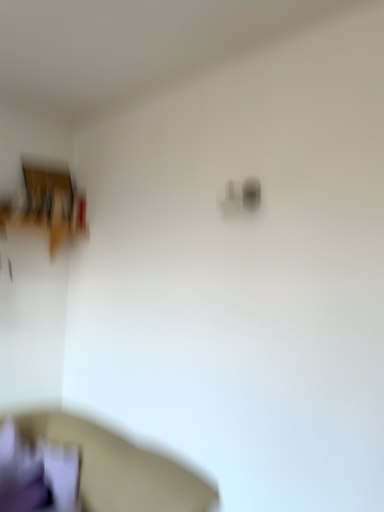
This screenshot has width=384, height=512. I want to click on purple fabric cushion at lower left, so click(x=120, y=468).

Image resolution: width=384 pixels, height=512 pixels. What do you see at coordinates (120, 468) in the screenshot? I see `purple fabric cushion at lower left` at bounding box center [120, 468].

Identify the location of purple fabric cushion at lower left. (120, 468).